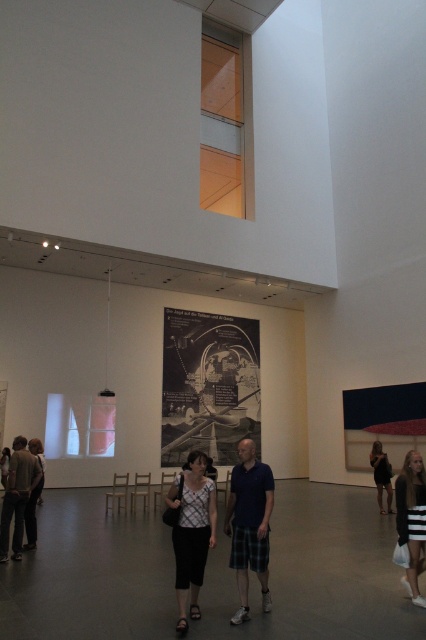
Is matte blue shirt at center smaller than matte gray pants at lower left?

Indeed, matte blue shirt at center has a smaller size compared to matte gray pants at lower left.

Does matte blue shirt at center have a lesser width compared to matte gray pants at lower left?

In fact, matte blue shirt at center might be wider than matte gray pants at lower left.

Who is more forward, (267, 516) or (13, 460)?

Positioned in front is point (267, 516).

Find the location of a particular element. The image size is (426, 640). matte blue shirt at center is located at coordinates (250, 524).

Is point (204, 548) positioned after point (376, 442)?

No, it is not.

Is white printed blouse at center bigger than dark gray sweater at lower right?

No, white printed blouse at center is not bigger than dark gray sweater at lower right.

Who is more forward, [186,522] or [383,467]?

Point [186,522] is more forward.

Identify the location of white printed blouse at center. (192, 532).

Can you confirm if matte gray pants at lower left is positioned above dark gray sweater at lower right?

Indeed, matte gray pants at lower left is positioned over dark gray sweater at lower right.

Between point (16, 515) and point (389, 481), which one is positioned in front?

Point (16, 515)

Locate an element on the screen. matte gray pants at lower left is located at coordinates (17, 496).